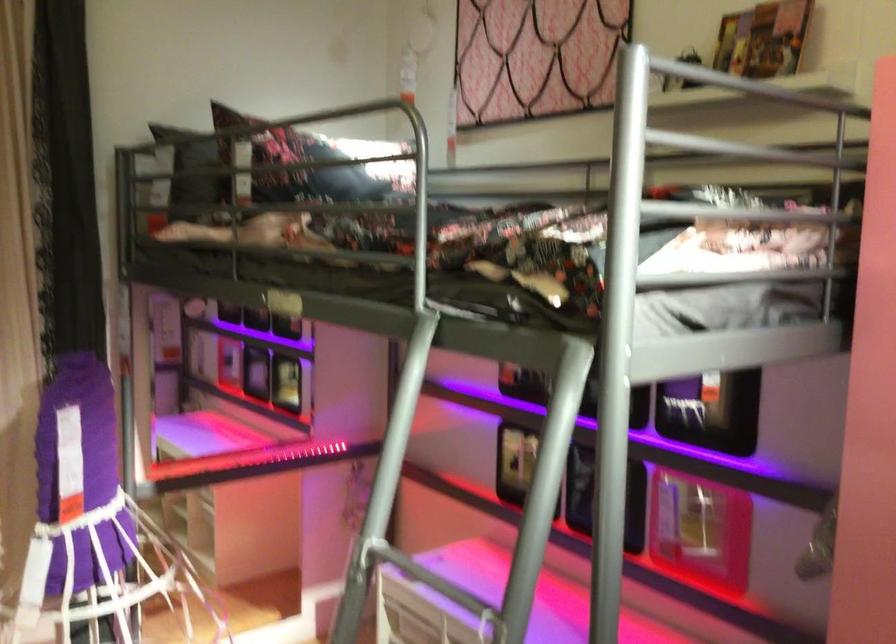
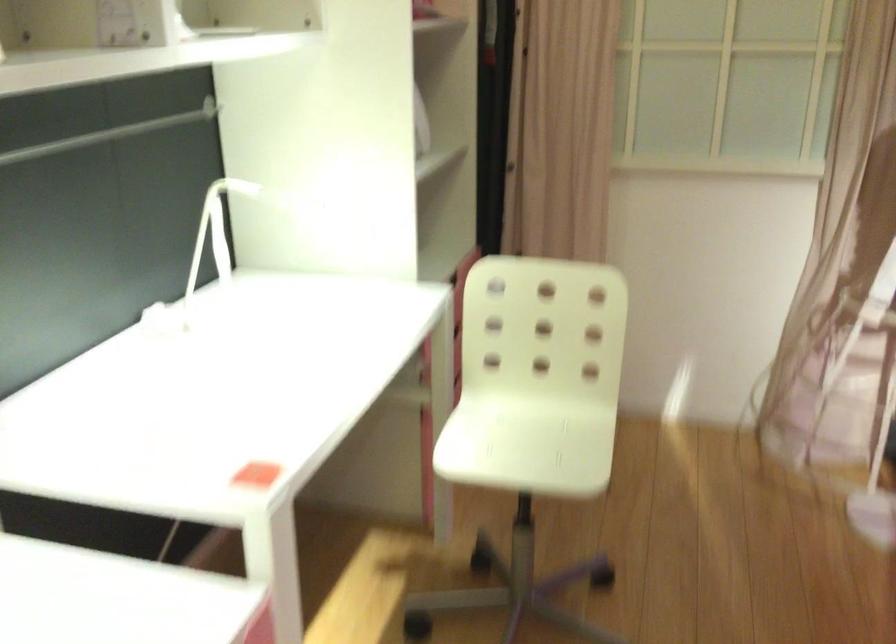
The images are taken continuously from a first-person perspective. In which direction is your viewpoint rotating?

The rotation direction of the camera is left-down.